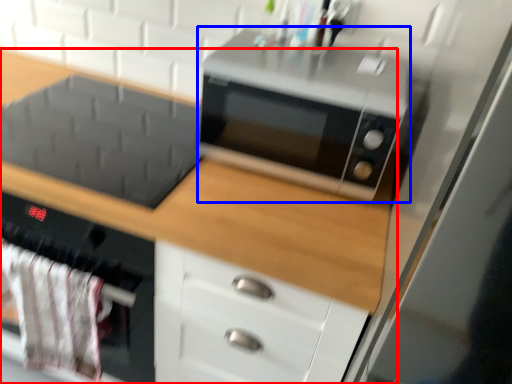
Question: Which of the following is the closest to the observer, cabinetry (highlighted by a red box) or microwave oven (highlighted by a blue box)?

Choices:
 (A) cabinetry
 (B) microwave oven

Answer: (A)